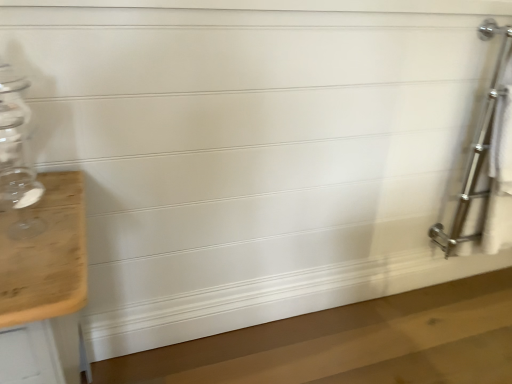
You are a GUI agent. You are given a task and a screenshot of the screen. Output one action in this format:
    pyautogui.click(x=<x>, y=<y>)
    Task: Click on the transparent glass jar at left
    This screenshot has height=384, width=512.
    Given the screenshot: What is the action you would take?
    pyautogui.click(x=16, y=158)

This screenshot has width=512, height=384. What do you see at coordinates (16, 158) in the screenshot?
I see `transparent glass jar at left` at bounding box center [16, 158].

Where is `polished chrome towel rack at right`? polished chrome towel rack at right is located at coordinates (475, 150).

This screenshot has width=512, height=384. What do you see at coordinates (475, 150) in the screenshot?
I see `polished chrome towel rack at right` at bounding box center [475, 150].

At what (x,y) coordinates should I click in order to perform the action: click on transparent glass jar at left. Please return your answer as a coordinate pair (x, y). Looking at the image, I should click on (16, 158).

Which object is positioned more to the left, transparent glass jar at left or polished chrome towel rack at right?

Positioned to the left is transparent glass jar at left.

Is transparent glass jar at left in front of or behind polished chrome towel rack at right in the image?

Clearly, transparent glass jar at left is in front of polished chrome towel rack at right.

Does point (9, 106) appear closer or farther from the camera than point (494, 23)?

Clearly, point (9, 106) is closer to the camera than point (494, 23).

From the image's perspective, is transparent glass jar at left beneath polished chrome towel rack at right?

Yes.

From a real-world perspective, is transparent glass jar at left positioned under polished chrome towel rack at right based on gravity?

Incorrect, from a real-world perspective, transparent glass jar at left is higher than polished chrome towel rack at right.

Considering the sizes of objects transparent glass jar at left and polished chrome towel rack at right in the image provided, who is wider, transparent glass jar at left or polished chrome towel rack at right?

transparent glass jar at left.

Is transparent glass jar at left shorter than polished chrome towel rack at right?

Indeed, transparent glass jar at left has a lesser height compared to polished chrome towel rack at right.

Is transparent glass jar at left smaller than polished chrome towel rack at right?

Yes.

Could polished chrome towel rack at right be considered to be inside transparent glass jar at left?

No.

Would you consider transparent glass jar at left to be distant from polished chrome towel rack at right?

transparent glass jar at left is far away from polished chrome towel rack at right.

Is transparent glass jar at left turned away from polished chrome towel rack at right?

transparent glass jar at left does not have its back to polished chrome towel rack at right.

How many degrees apart are the facing directions of transparent glass jar at left and polished chrome towel rack at right?

The angular difference between transparent glass jar at left and polished chrome towel rack at right is 0.769 degrees.

The width and height of the screenshot is (512, 384). Find the location of `glass bottle above the polished chrome towel rack at right (from a real-world perspective)`. glass bottle above the polished chrome towel rack at right (from a real-world perspective) is located at coordinates (16, 158).

Is polished chrome towel rack at right to the left or to the right of transparent glass jar at left in the image?

In the image, polished chrome towel rack at right appears on the right side of transparent glass jar at left.

Does polished chrome towel rack at right lie in front of transparent glass jar at left?

That is False.

Which is behind, point (457, 228) or point (22, 132)?

The point (457, 228) is behind.

From the image's perspective, which one is positioned higher, polished chrome towel rack at right or transparent glass jar at left?

polished chrome towel rack at right is shown above in the image.

From a real-world perspective, who is located lower, polished chrome towel rack at right or transparent glass jar at left?

polished chrome towel rack at right, from a real-world perspective.

Does polished chrome towel rack at right have a lesser width compared to transparent glass jar at left?

Correct, the width of polished chrome towel rack at right is less than that of transparent glass jar at left.

Between polished chrome towel rack at right and transparent glass jar at left, which one has less height?

Standing shorter between the two is transparent glass jar at left.

Considering the sizes of objects polished chrome towel rack at right and transparent glass jar at left in the image provided, who is smaller, polished chrome towel rack at right or transparent glass jar at left?

With smaller size is transparent glass jar at left.

Consider the image. Choose the correct answer: Is polished chrome towel rack at right inside transparent glass jar at left or outside it?

polished chrome towel rack at right cannot be found inside transparent glass jar at left.

Can you see polished chrome towel rack at right touching transparent glass jar at left?

No, polished chrome towel rack at right is not touching transparent glass jar at left.

Could you tell me if polished chrome towel rack at right is facing transparent glass jar at left?

No.

The image size is (512, 384). Find the location of `glass bottle above the polished chrome towel rack at right (from a real-world perspective)`. glass bottle above the polished chrome towel rack at right (from a real-world perspective) is located at coordinates (16, 158).

I want to click on glass bottle above the polished chrome towel rack at right (from a real-world perspective), so click(x=16, y=158).

Where is `ladder that is behind the transparent glass jar at left`? ladder that is behind the transparent glass jar at left is located at coordinates (475, 150).